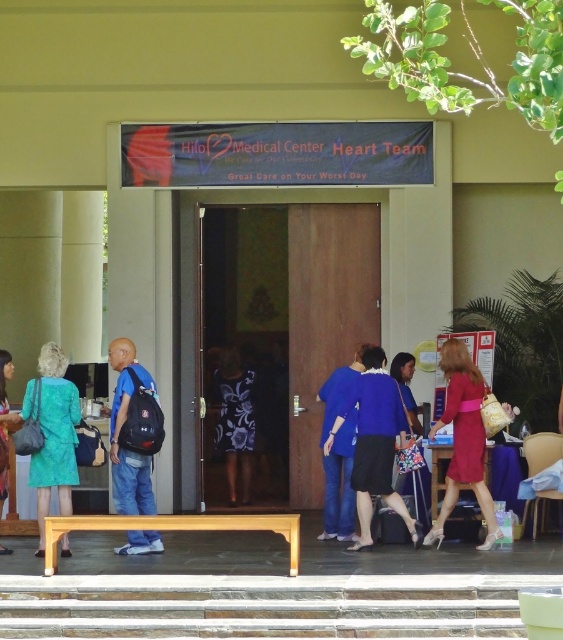
Question: Which point appears farthest from the camera in this image?

Choices:
 (A) (333, 394)
 (B) (473, 412)

Answer: (A)

Question: Based on their relative distances, which object is farther from the teal fabric dress at left?

Choices:
 (A) blue fabric dress at center
 (B) blue denim jeans at lower left
 (C) matte green dress at lower left
 (D) gray stone stairs at center

Answer: (A)

Question: From the image, what is the correct spatial relationship of wooden door at center in relation to floral dress at center?

Choices:
 (A) left
 (B) right

Answer: (B)

Question: Is gray stone stairs at center above blue denim jeans at lower left?

Choices:
 (A) yes
 (B) no

Answer: (B)

Question: Estimate the real-world distances between objects in this image. Which object is closer to the blue fabric dress at center?

Choices:
 (A) gray stone stairs at center
 (B) blue denim jeans at lower left

Answer: (A)

Question: Considering the relative positions of teal fabric dress at left and matte green dress at lower left in the image provided, where is teal fabric dress at left located with respect to matte green dress at lower left?

Choices:
 (A) right
 (B) left

Answer: (A)